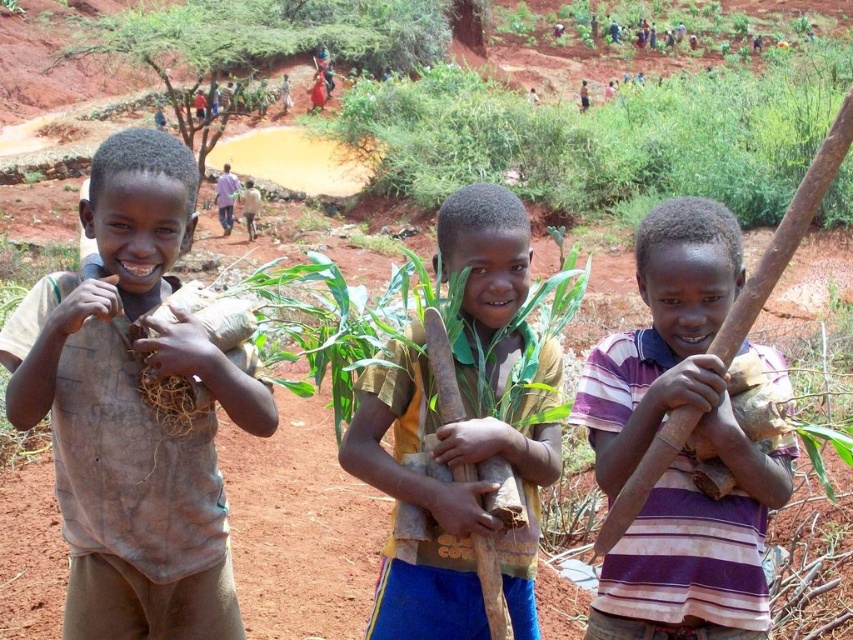
Which is more to the right, yellow cotton shirt at center or purple striped shirt at center?

purple striped shirt at center is more to the right.

Is point (515, 512) more distant than point (602, 596)?

That is False.

The width and height of the screenshot is (853, 640). What are the coordinates of `yellow cotton shirt at center` in the screenshot? It's located at (463, 433).

Is green leafy plant at upper center to the right of purple striped shirt at center from the viewer's perspective?

Yes, green leafy plant at upper center is to the right of purple striped shirt at center.

This screenshot has height=640, width=853. What do you see at coordinates (601, 138) in the screenshot?
I see `green leafy plant at upper center` at bounding box center [601, 138].

Does point (473, 173) lie in front of point (672, 472)?

No, (473, 173) is further to viewer.

This screenshot has width=853, height=640. What are the coordinates of `green leafy plant at upper center` in the screenshot? It's located at (601, 138).

At what (x,y) coordinates should I click in order to perform the action: click on brown mud shirt at left. Please return your answer as a coordinate pair (x, y). The height and width of the screenshot is (640, 853). Looking at the image, I should click on (132, 410).

You are a GUI agent. You are given a task and a screenshot of the screen. Output one action in this format:
    pyautogui.click(x=<x>, y=<y>)
    Task: Click on the brown mud shirt at left
    
    Given the screenshot: What is the action you would take?
    pyautogui.click(x=132, y=410)